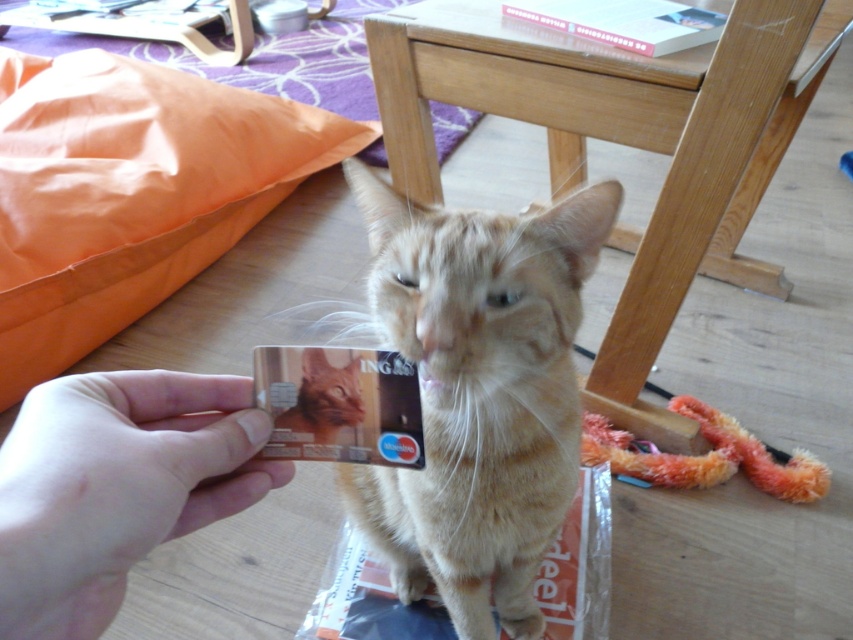
Question: In this image, where is wooden stool at center located relative to golden fur cat at center?

Choices:
 (A) left
 (B) right

Answer: (B)

Question: Can you confirm if wooden stool at center is thinner than golden fur cat at center?

Choices:
 (A) yes
 (B) no

Answer: (B)

Question: Does wooden stool at center appear on the right side of golden fur cat at center?

Choices:
 (A) yes
 (B) no

Answer: (A)

Question: Which object appears farthest from the camera in this image?

Choices:
 (A) wooden stool at center
 (B) light brown fur cat at center
 (C) smooth skin hand at lower left
 (D) golden fur cat at center

Answer: (A)

Question: Which object appears farthest from the camera in this image?

Choices:
 (A) wooden stool at center
 (B) golden fur cat at center

Answer: (A)

Question: Which point is farther from the camera taking this photo?

Choices:
 (A) (560, 467)
 (B) (103, 433)
 (C) (630, 276)
 (D) (346, 419)

Answer: (C)